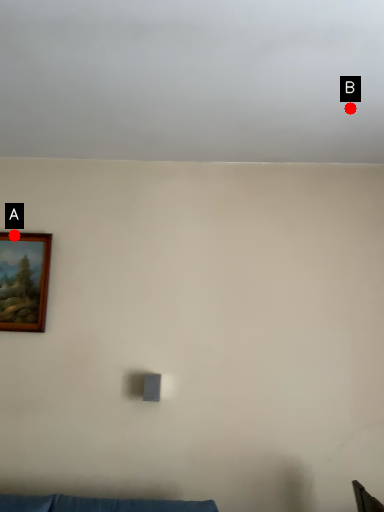
Question: Two points are circled on the image, labeled by A and B beside each circle. Which point is closer to the camera?

Choices:
 (A) A is closer
 (B) B is closer

Answer: (B)